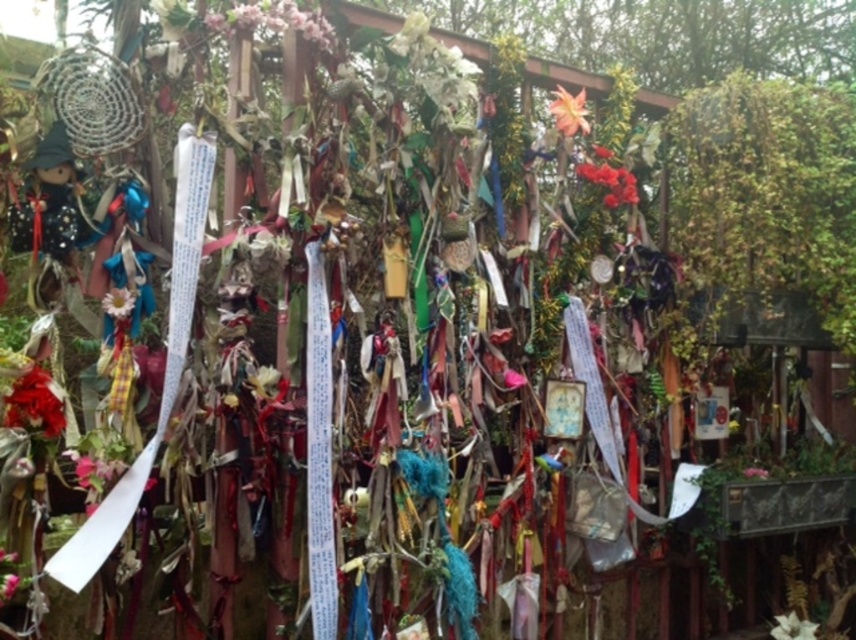
Which is behind, point (9, 413) or point (794, 624)?

Positioned behind is point (794, 624).

Which is in front, point (58, 424) or point (816, 627)?

Positioned in front is point (58, 424).

You are a GUI agent. You are given a task and a screenshot of the screen. Output one action in this format:
    pyautogui.click(x=<x>, y=<y>)
    Task: Click on the matte red flower at lower left
    This screenshot has height=640, width=856.
    Given the screenshot: What is the action you would take?
    pyautogui.click(x=34, y=403)

Does vivid red petals at center appear on the left side of white matte flower at center?

Indeed, vivid red petals at center is positioned on the left side of white matte flower at center.

Can you confirm if vivid red petals at center is positioned to the right of white matte flower at center?

In fact, vivid red petals at center is to the left of white matte flower at center.

At what (x,y) coordinates should I click in order to perform the action: click on vivid red petals at center. Please return your answer as a coordinate pair (x, y). This screenshot has width=856, height=640. Looking at the image, I should click on (610, 182).

At what (x,y) coordinates should I click in order to perform the action: click on vivid red petals at center. Please return your answer as a coordinate pair (x, y). Looking at the image, I should click on (610, 182).

Can you confirm if orange matte flower at upper center is positioned to the left of white matte flower at center?

Indeed, orange matte flower at upper center is positioned on the left side of white matte flower at center.

Does orange matte flower at upper center have a lesser width compared to white matte flower at center?

Yes, orange matte flower at upper center is thinner than white matte flower at center.

Locate an element on the screen. orange matte flower at upper center is located at coordinates (569, 112).